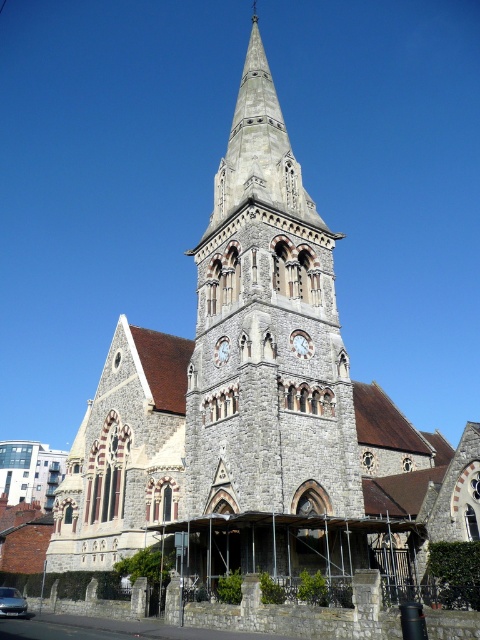
You are a construction worker assessing the height of the gray stone tower at center and the light gray stone clock at center. Which one is taller?

The gray stone tower at center is taller than the light gray stone clock at center.